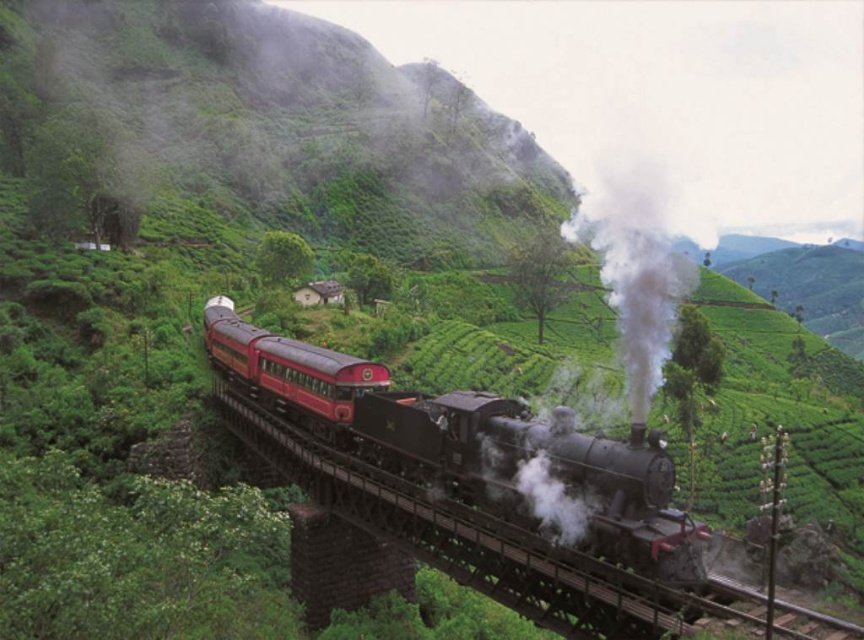
Is white matte smoke at center taller than polished red passenger train at center?

Indeed, white matte smoke at center has a greater height compared to polished red passenger train at center.

Does point (633, 404) come closer to viewer compared to point (340, 385)?

No, (633, 404) is behind (340, 385).

The width and height of the screenshot is (864, 640). I want to click on white matte smoke at center, so click(x=634, y=260).

Which of these two, polished black steam engine at center or white matte smoke at center, stands shorter?

polished black steam engine at center

Measure the distance from polished black steam engine at center to white matte smoke at center.

A distance of 48.53 meters exists between polished black steam engine at center and white matte smoke at center.

Is point (618, 557) in front of point (633, 272)?

Yes, it is.

The height and width of the screenshot is (640, 864). I want to click on polished black steam engine at center, so click(550, 472).

Does polished black steam locomotive at center appear under white matte smoke at center?

Indeed, polished black steam locomotive at center is positioned under white matte smoke at center.

Is point (383, 380) positioned behind point (649, 339)?

Yes.

In order to click on polished black steam locomotive at center in this screenshot , I will do `click(471, 448)`.